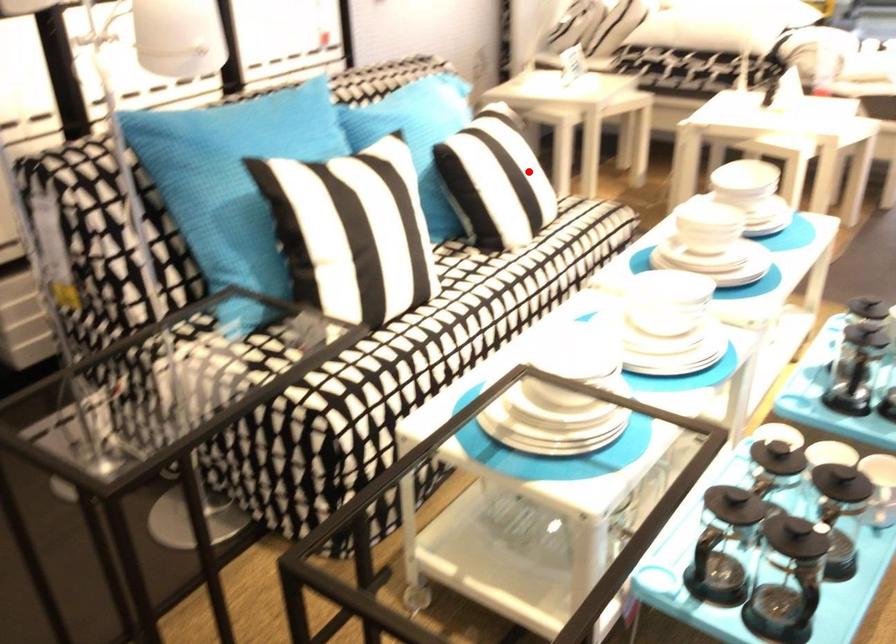
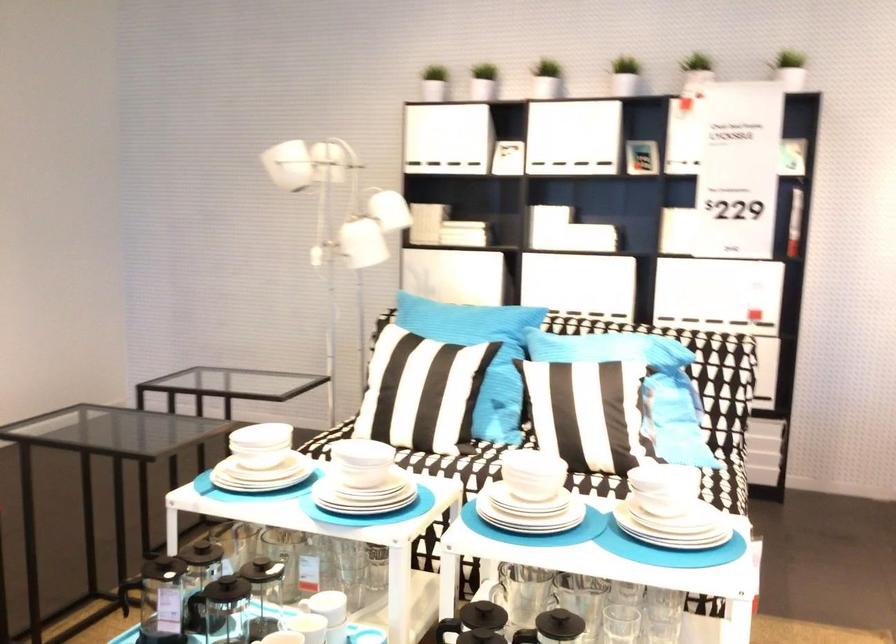
Question: I am providing you with two images of the same scene from different viewpoints. Image1 has a red point marked. In image2, the corresponding 3D location appears at what relative position? Reply with the corresponding letter.

Choices:
 (A) Closer
 (B) Farther

Answer: (B)